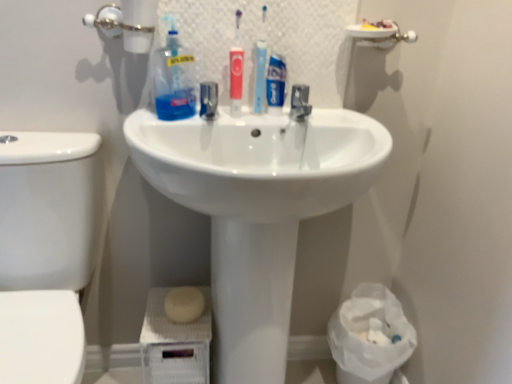
Locate an element on the screen. The width and height of the screenshot is (512, 384). free spot above white matte soap at lower center (from a real-world perspective) is located at coordinates (180, 324).